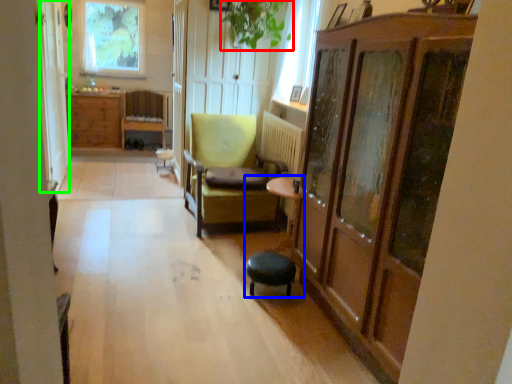
Question: Estimate the real-world distances between objects in this image. Which object is closer to plant (highlighted by a red box), swivel chair (highlighted by a blue box) or screen door (highlighted by a green box)?

Choices:
 (A) swivel chair
 (B) screen door

Answer: (B)